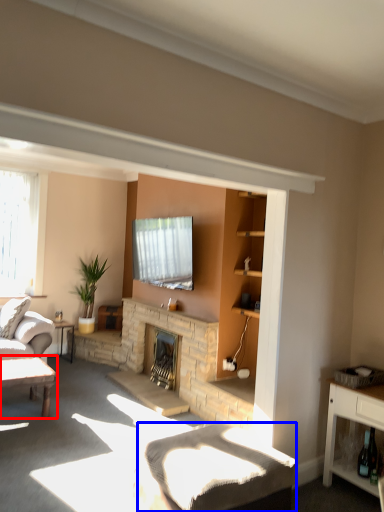
Question: Which object is further to the camera taking this photo, table (highlighted by a red box) or plain (highlighted by a blue box)?

Choices:
 (A) table
 (B) plain

Answer: (A)